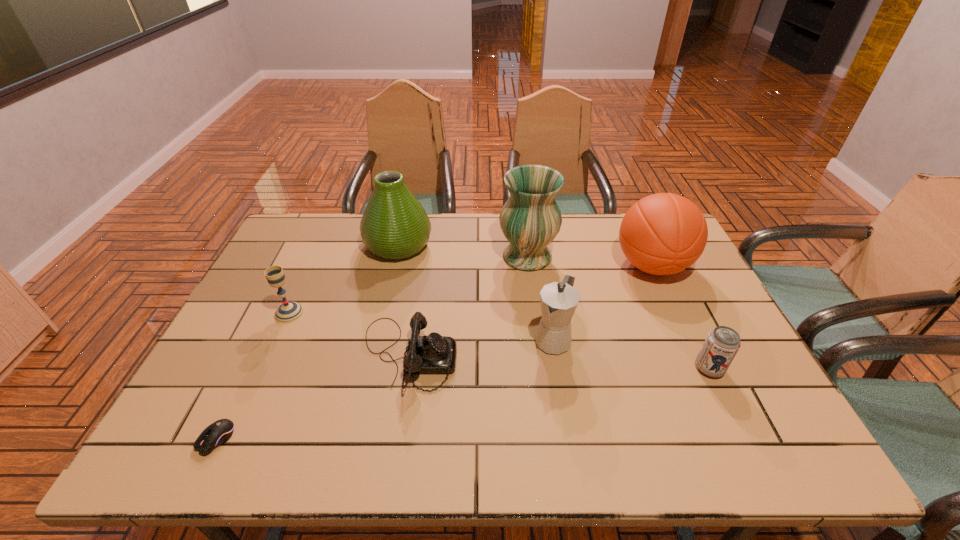
Image resolution: width=960 pixels, height=540 pixels. I want to click on vacant space located on the right of the left vase, so [x=462, y=245].

Where is `vacant space located on the front of the basketball`? vacant space located on the front of the basketball is located at coordinates (712, 396).

This screenshot has width=960, height=540. I want to click on vacant region located 0.180m on the left of the fourth tallest object, so click(x=467, y=339).

You are a GUI agent. You are given a task and a screenshot of the screen. Output one action in this format:
    pyautogui.click(x=<x>, y=<y>)
    Task: Click on the vacant space located 0.090m on the back of the chalice
    This screenshot has height=540, width=960.
    Given the screenshot: What is the action you would take?
    pyautogui.click(x=303, y=282)

Identify the location of vacant position located on the left of the beer can. [x=627, y=368].

The image size is (960, 540). I want to click on free space located 0.230m on the front-facing side of the seventh tallest object, so click(x=546, y=356).

You are a GUI agent. You are given a task and a screenshot of the screen. Output one action in this format:
    pyautogui.click(x=<x>, y=<y>)
    Task: Click on the free space located 0.070m on the back of the nearest object
    
    Given the screenshot: What is the action you would take?
    pyautogui.click(x=237, y=395)

The height and width of the screenshot is (540, 960). Find the location of `basketball present at the far edge`. basketball present at the far edge is located at coordinates (662, 234).

Identify the location of object that is at the near edge. This screenshot has width=960, height=540. (219, 432).

The width and height of the screenshot is (960, 540). In order to click on chalice positioned at the left edge in this screenshot , I will do `click(288, 312)`.